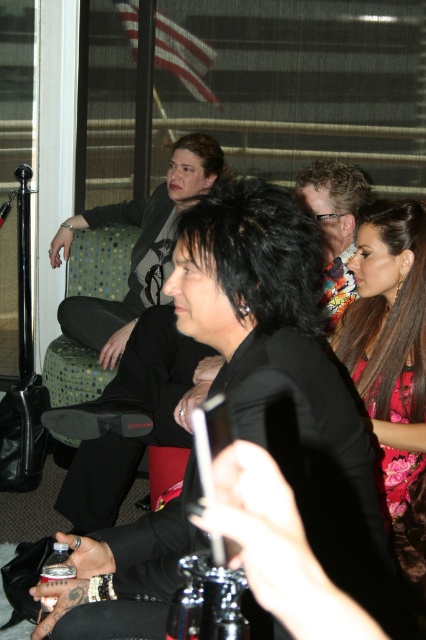
You are standing in the room and want to place a 2.0 meter long banner on the wall. The banner must be placed at a point that is exactly 2.0 meters away from where you are standing. Is the point at coordinates point(379, 392) suitable for placing the banner?

The distance of point(379, 392) from camera is 1.88 meters, so placing the banner there would be too close since it requires being exactly 2.0 meters away. You need to find a point that is 0.12 meters further away.

You are standing in the same room as the people in the image. There is a matte black jacket at upper left represented by point (137, 248). If you want to move towards the matte black jacket at upper left, which direction should you walk?

To move towards the matte black jacket at upper left represented by point (137, 248), you should walk towards the upper left direction.